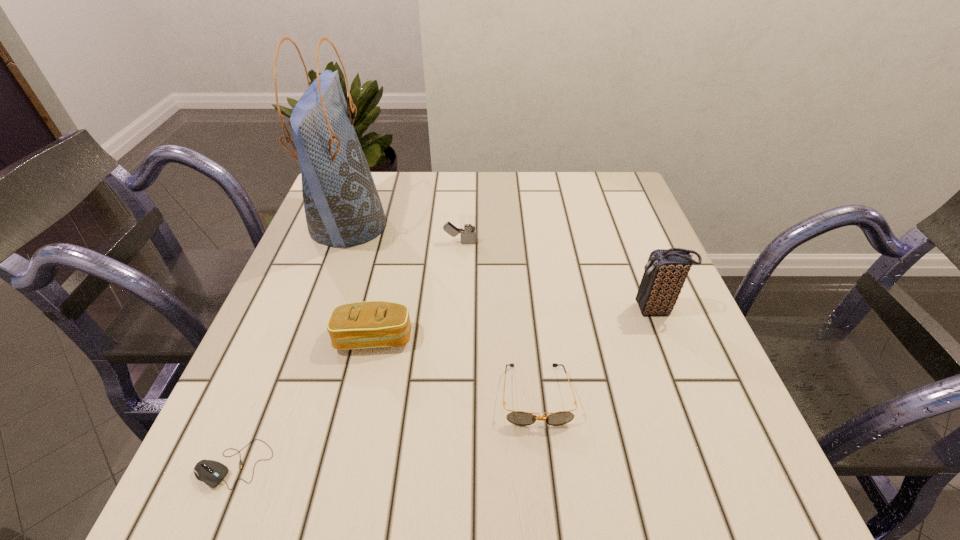
This screenshot has width=960, height=540. I want to click on vacant position located 0.070m on the right of the tallest object, so click(x=414, y=225).

Image resolution: width=960 pixels, height=540 pixels. I want to click on free space located with the zip open on the rightmost object, so [492, 310].

I want to click on vacant space located 0.330m with the zip open on the rightmost object, so click(473, 310).

Locate an element on the screen. This screenshot has height=540, width=960. free space located 0.210m with the zip open on the rightmost object is located at coordinates (531, 310).

Where is `vacant space situated on the right of the igniter`? The width and height of the screenshot is (960, 540). vacant space situated on the right of the igniter is located at coordinates (509, 242).

I want to click on vacant area situated 0.200m on the zipper side of the left clutch bag, so click(347, 461).

This screenshot has width=960, height=540. I want to click on free region located 0.060m on the front-facing side of the fifth tallest object, so click(543, 464).

Where is `vacant space situated 0.370m on the back of the computer mouse`? Image resolution: width=960 pixels, height=540 pixels. vacant space situated 0.370m on the back of the computer mouse is located at coordinates (309, 282).

Image resolution: width=960 pixels, height=540 pixels. Find the location of `object situated at the far edge`. object situated at the far edge is located at coordinates (342, 206).

Identify the location of object situated at the near edge. This screenshot has width=960, height=540. (211, 472).